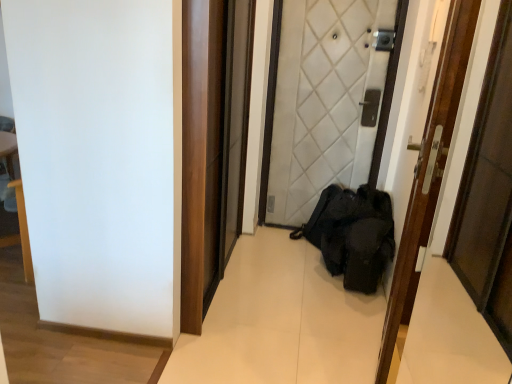
Where is `vacant space behind wooden door at center, the 1th door in the front-to-back sequence`? vacant space behind wooden door at center, the 1th door in the front-to-back sequence is located at coordinates (329, 294).